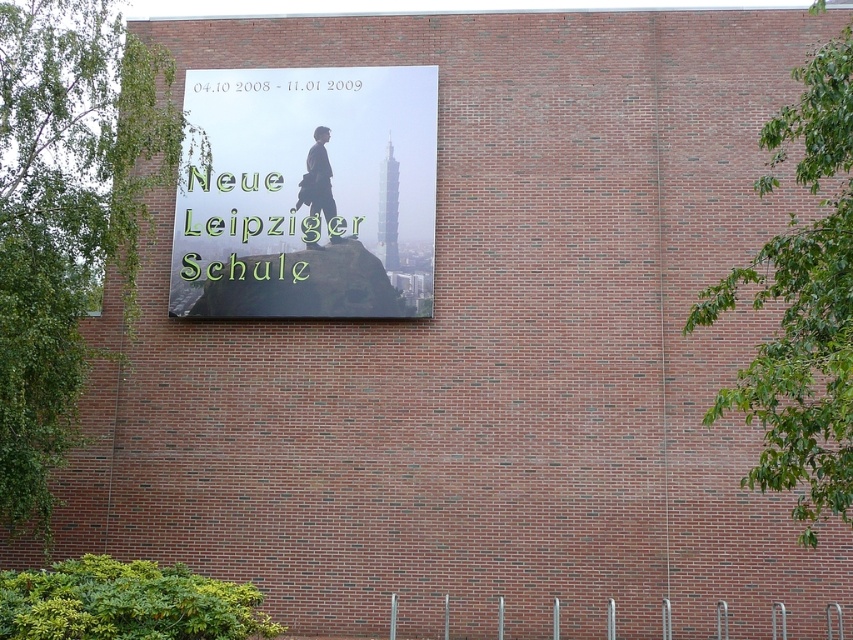
Question: Which object is farther from the camera taking this photo?

Choices:
 (A) matte glass sign at center
 (B) matte black suit at center

Answer: (B)

Question: Can you confirm if matte glass sign at center is positioned to the right of matte black suit at center?

Choices:
 (A) no
 (B) yes

Answer: (A)

Question: Is matte glass sign at center positioned at the back of matte black suit at center?

Choices:
 (A) yes
 (B) no

Answer: (B)

Question: Is matte glass sign at center behind matte black suit at center?

Choices:
 (A) yes
 (B) no

Answer: (B)

Question: Among these points, which one is nearest to the camera?

Choices:
 (A) (352, 134)
 (B) (329, 177)

Answer: (B)